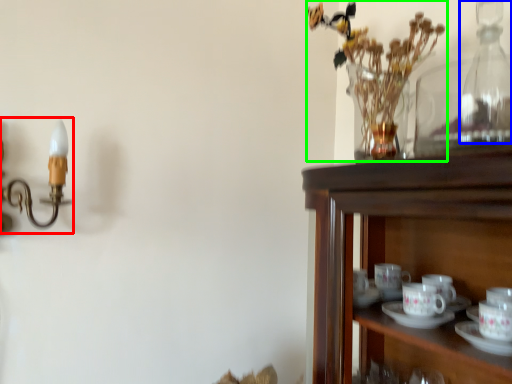
Question: Estimate the real-world distances between objects in this image. Which object is closer to candle holder (highlighted by a red box), bottle (highlighted by a blue box) or floral arrangement (highlighted by a green box)?

Choices:
 (A) bottle
 (B) floral arrangement

Answer: (B)